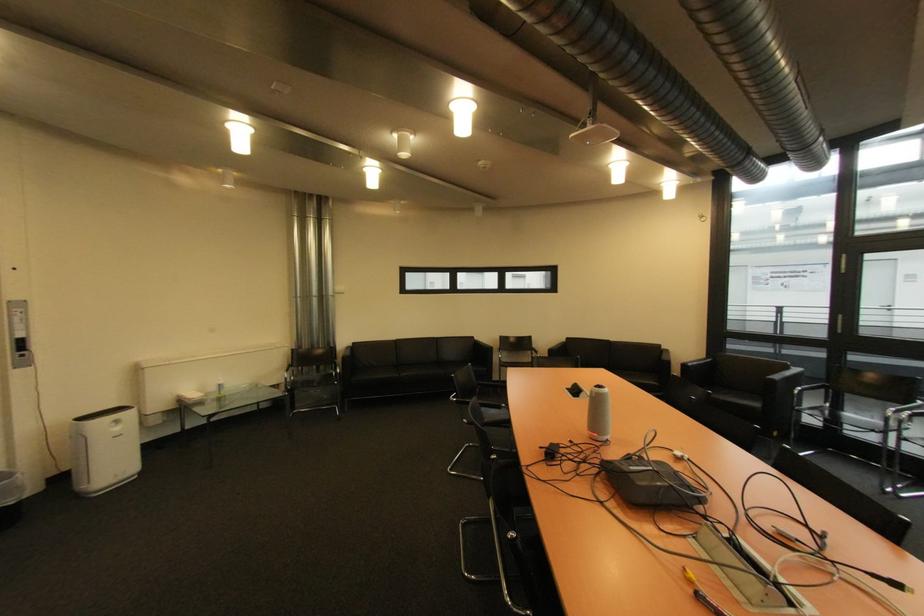
Find where to grasp the black chair armrest. Please return your answer as a coordinate pair (x, y).

(811, 387)